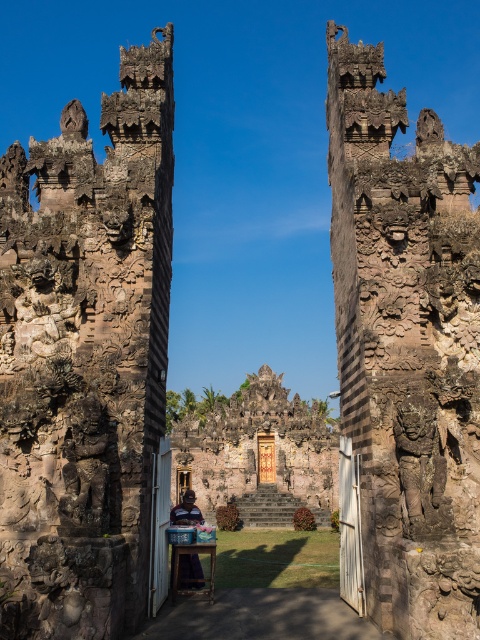
Does point (317, 406) come farther from viewer compared to point (176, 512)?

Yes, point (317, 406) is farther from viewer.

Does carved stone temple at center have a lesser height compared to blue fabric at center?

No, carved stone temple at center is not shorter than blue fabric at center.

The height and width of the screenshot is (640, 480). What are the coordinates of `carved stone temple at center` in the screenshot? It's located at [x=259, y=456].

Can you confirm if carved stone temple at center is wider than wooden stool at center?

Correct, the width of carved stone temple at center exceeds that of wooden stool at center.

Is point (274, 522) farther from viewer compared to point (213, 552)?

Yes, it is.

In order to click on carved stone temple at center in this screenshot , I will do `click(259, 456)`.

Is blue fabric at center further to camera compared to wooden stool at center?

That is True.

Is blue fabric at center shorter than wooden stool at center?

No, blue fabric at center is not shorter than wooden stool at center.

Image resolution: width=480 pixels, height=640 pixels. I want to click on blue fabric at center, so click(x=186, y=509).